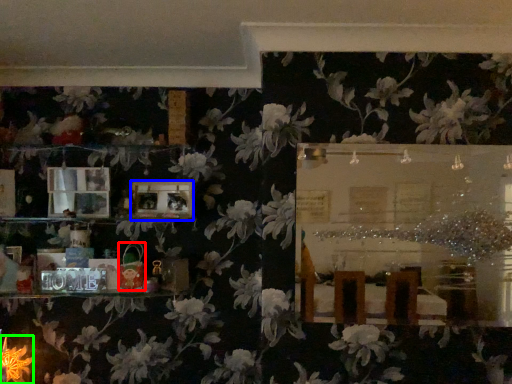
Question: Based on their relative distances, which object is farther from toy (highlighted by a red box)? Choose from picture frame (highlighted by a blue box) and flower (highlighted by a green box).

Choices:
 (A) picture frame
 (B) flower

Answer: (B)